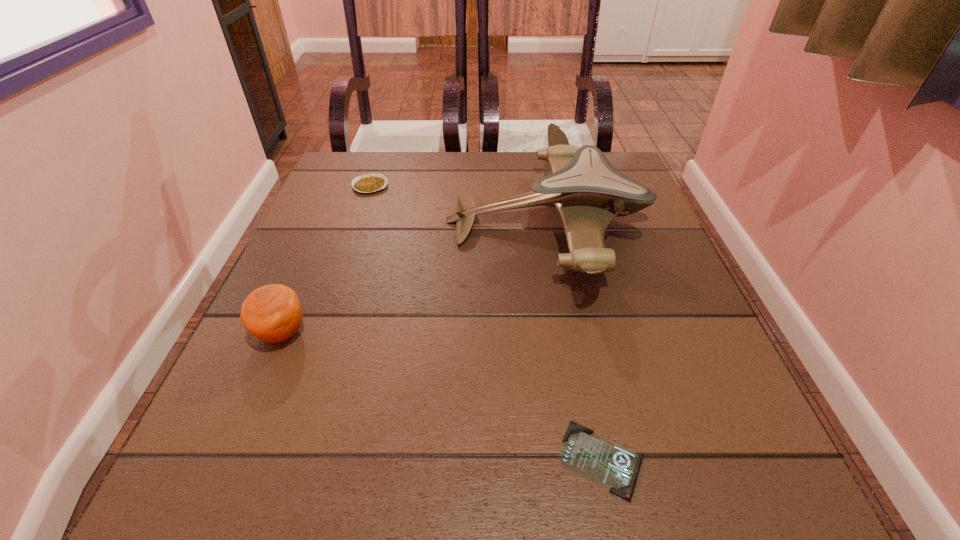
Find the location of a particular element. The image size is (960, 540). the tallest object is located at coordinates (588, 192).

Identify the location of orange. (272, 313).

Image resolution: width=960 pixels, height=540 pixels. Identify the location of legume. pyautogui.click(x=368, y=183).

Where is `the shortest object`? The width and height of the screenshot is (960, 540). the shortest object is located at coordinates (613, 466).

At what (x,y) coordinates should I click in order to perform the action: click on identity card. Please return your answer as a coordinate pair (x, y). Image resolution: width=960 pixels, height=540 pixels. Looking at the image, I should click on (613, 466).

What are the coordinates of `vacant area situated 0.050m on the front-facing side of the tallest object` in the screenshot? It's located at (424, 221).

The image size is (960, 540). Find the location of `vacant region located 0.290m on the front-facing side of the tallest object`. vacant region located 0.290m on the front-facing side of the tallest object is located at coordinates (316, 221).

Identify the location of free spot located 0.290m on the front-facing side of the tallest object. (316, 221).

Where is `vacant space situated 0.100m on the right of the orange`? vacant space situated 0.100m on the right of the orange is located at coordinates (368, 333).

You are a GUI agent. You are given a task and a screenshot of the screen. Output one action in this format:
    pyautogui.click(x=<x>, y=<y>)
    Task: Click on the vacant space located on the front of the second shortest object
    
    Given the screenshot: What is the action you would take?
    pyautogui.click(x=358, y=220)